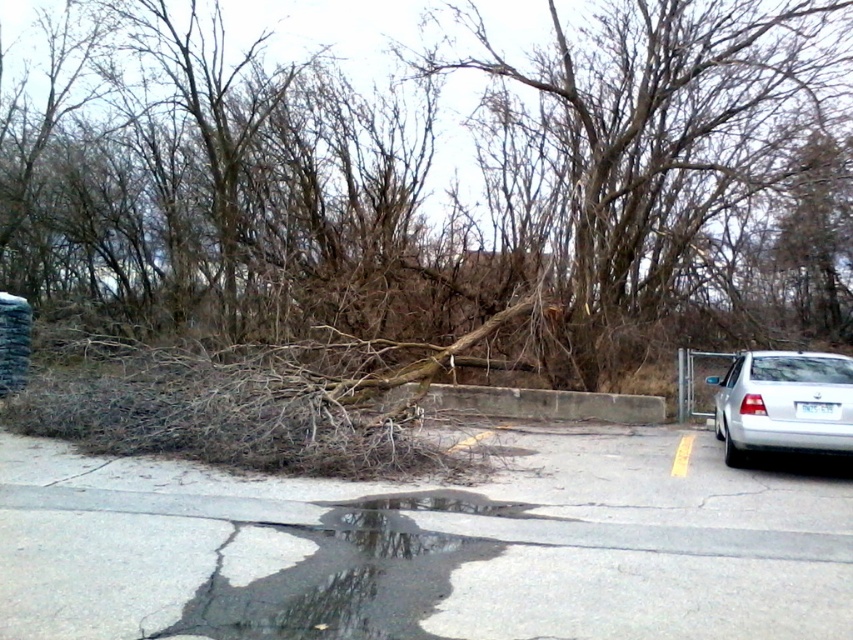
You are a delivery driver who needs to park your truck in the parking lot. You see the transparent wet asphalt at lower center and the silver metallic sedan at right. Which parking spot is safer to choose for avoiding slippery surfaces?

The silver metallic sedan at right is safer because the transparent wet asphalt at lower center is to the left of it, indicating a slippery area nearby.

Based on the photo, you are standing in the parking lot and want to reach the point marked at coordinates (428,589). Considering the puddle and the pile of branches in your path, can you safely walk to that point without stepping into the puddle or on the branches?

The point marked at coordinates (428,589) is 4.60 meters away from you. However, there is a puddle and a pile of branches in the way. To avoid them, you would need to find an alternative path around these obstacles. The safest route would require navigating around the puddle and the branches, but since their exact positions aren not specified, it is uncertain if a clear path exists.

You are driving a car and want to park in the parking lot. You see the brown dry branches at center and the silver metallic sedan at right. Which object is closer to the right side of the parking lot?

The silver metallic sedan at right is closer to the right side of the parking lot because it is positioned to the right of the brown dry branches at center.